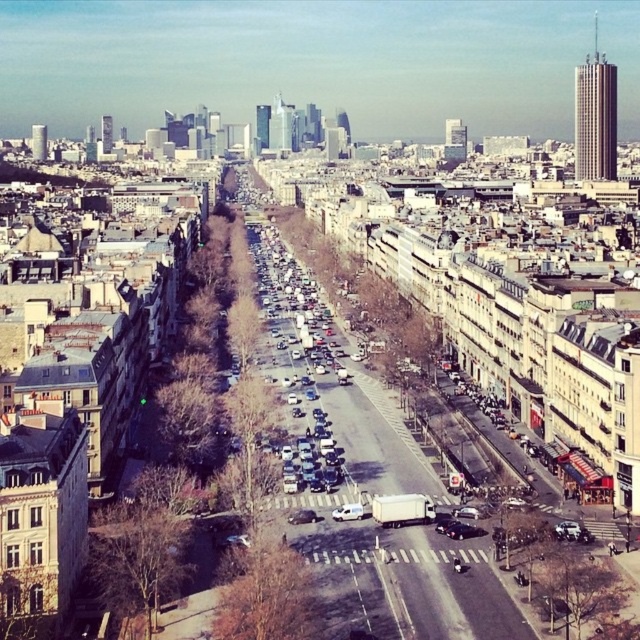
You are a delivery driver navigating an urban area and need to make a left turn onto a side street that is 100 meters ahead. The white matte van at center is blocking your path. Can you safely maneuver around it without crossing into oncoming traffic?

The white matte van at center is located at point coordinates that might be obstructing the left turn path. However, since the exact spatial relationship between the van and the side street isn not provided in the Objects Description, it is unclear whether it is directly blocking the path or can be navigated around safely. Please check the actual distance and positioning for safe maneuvering.

You are a delivery driver who needs to park your vehicle in a tight space between the white matte van at center and the metallic silver car at center. Based on their sizes, which vehicle should you position closer to when parking to ensure enough space?

Since the white matte van at center is larger than the metallic silver car at center, you should position your vehicle closer to the metallic silver car at center to ensure sufficient space for maneuvering.